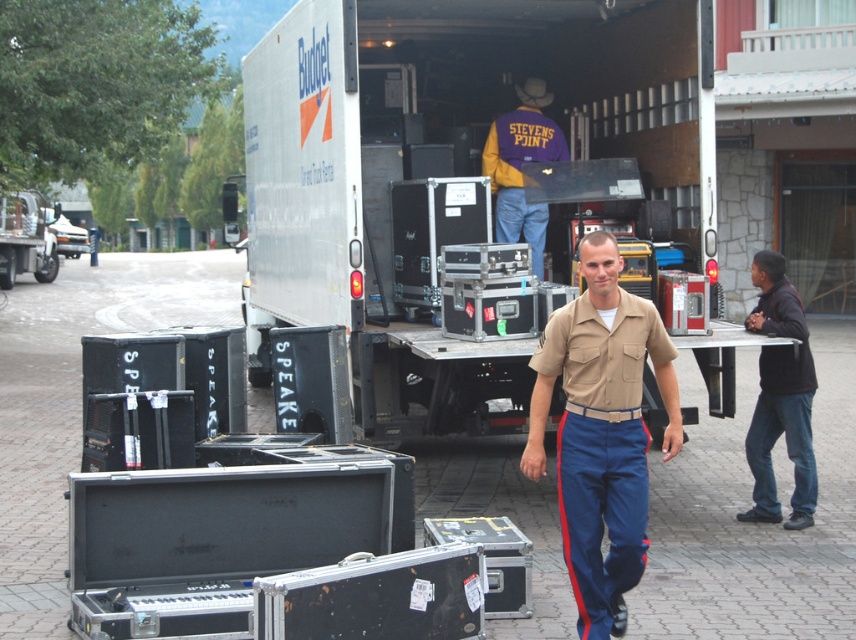
Question: From the image, what is the correct spatial relationship of khaki uniform at center in relation to black matte jacket at right?

Choices:
 (A) right
 (B) left

Answer: (B)

Question: Which point appears closest to the camera in this image?

Choices:
 (A) (813, 474)
 (B) (569, 401)
 (C) (417, 410)

Answer: (B)

Question: Which is nearer to the white matte trailer truck at center?

Choices:
 (A) purple/yellow jacket at center
 (B) black matte jacket at right

Answer: (A)

Question: Is white matte trailer truck at center closer to the viewer compared to brushed metal speaker at left?

Choices:
 (A) yes
 (B) no

Answer: (A)

Question: Is white matte trailer truck at center to the right of black matte jacket at right from the viewer's perspective?

Choices:
 (A) yes
 (B) no

Answer: (B)

Question: Which is farther from the black matte jacket at right?

Choices:
 (A) purple/yellow jacket at center
 (B) brushed metal speaker at left

Answer: (B)